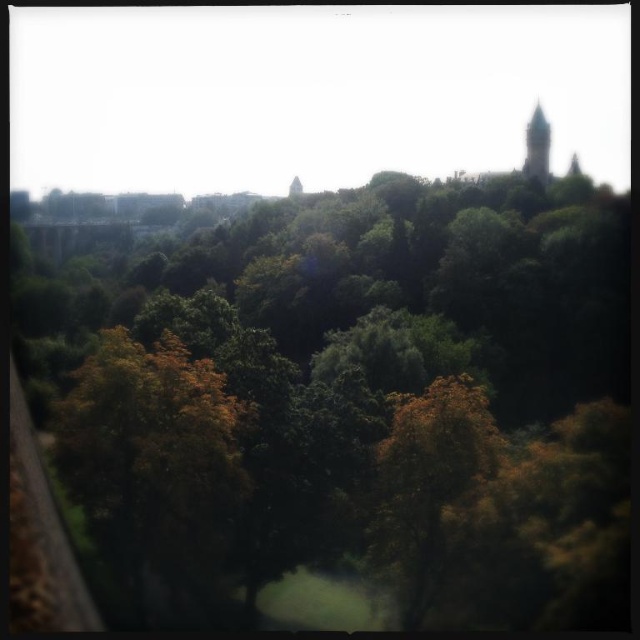
Is green leafy tree at center thinner than greenish-blue stone spire at upper right?

Incorrect, green leafy tree at center's width is not less than greenish-blue stone spire at upper right's.

Is green leafy tree at center above greenish-blue stone spire at upper right?

Result: No, green leafy tree at center is not above greenish-blue stone spire at upper right.

Who is more forward, (477, 348) or (529, 161)?

Positioned in front is point (477, 348).

This screenshot has width=640, height=640. What are the coordinates of `green leafy tree at center` in the screenshot? It's located at (355, 403).